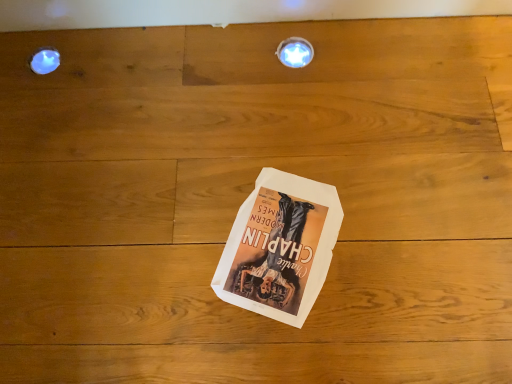
Where is `white paper at center`? white paper at center is located at coordinates (280, 247).

You are a GUI agent. You are given a task and a screenshot of the screen. Output one action in this format:
    pyautogui.click(x=<x>, y=<y>)
    Task: Click on the metallic circular light fixture at upper center
    This screenshot has height=384, width=512.
    Given the screenshot: What is the action you would take?
    pyautogui.click(x=295, y=52)

Is metallic circular light fixture at upper center directly adjacent to white paper at center?

They are not placed beside each other.

Does metallic circular light fixture at upper center have a greater height compared to white paper at center?

Yes.

Relative to white paper at center, is metallic circular light fixture at upper center in front or behind?

In the image, metallic circular light fixture at upper center appears behind white paper at center.

In terms of height, does white paper at center look taller or shorter compared to metallic circular light fixture at upper center?

white paper at center is shorter than metallic circular light fixture at upper center.

Would you say white paper at center is outside metallic circular light fixture at upper center?

That's correct, white paper at center is outside of metallic circular light fixture at upper center.

Which is farther from the camera, (311,204) or (293,45)?

Positioned behind is point (293,45).

Are metallic circular light fixture at upper center and matte white droplight at upper left beside each other?

They are not placed beside each other.

Is metallic circular light fixture at upper center taller than matte white droplight at upper left?

Yes.

Between metallic circular light fixture at upper center and matte white droplight at upper left, which one has larger width?

metallic circular light fixture at upper center.

Where is `droplight that appears above the white paper at center (from the image's perspective)`? The height and width of the screenshot is (384, 512). droplight that appears above the white paper at center (from the image's perspective) is located at coordinates (45, 60).

From a real-world perspective, does white paper at center stand above matte white droplight at upper left?

Correct, in the physical world, white paper at center is higher than matte white droplight at upper left.

Is white paper at center beside matte white droplight at upper left?

No, white paper at center is not touching matte white droplight at upper left.

From the image's perspective, is white paper at center on matte white droplight at upper left?

Incorrect, from the image's perspective, white paper at center is lower than matte white droplight at upper left.

Could you tell me if matte white droplight at upper left is facing white paper at center?

No, matte white droplight at upper left is not facing towards white paper at center.

From the image's perspective, who appears lower, matte white droplight at upper left or white paper at center?

white paper at center, from the image's perspective.

From the picture: Considering the sizes of matte white droplight at upper left and white paper at center in the image, is matte white droplight at upper left bigger or smaller than white paper at center?

Clearly, matte white droplight at upper left is smaller in size than white paper at center.

From a real-world perspective, between matte white droplight at upper left and white paper at center, who is vertically lower?

In real-world perspective, matte white droplight at upper left is lower.

From a real-world perspective, who is located higher, matte white droplight at upper left or metallic circular light fixture at upper center?

metallic circular light fixture at upper center is physically above.

Where is `droplight that is behind the metallic circular light fixture at upper center`? droplight that is behind the metallic circular light fixture at upper center is located at coordinates (45, 60).

Is matte white droplight at upper left shorter than metallic circular light fixture at upper center?

Yes.

Are matte white droplight at upper left and metallic circular light fixture at upper center beside each other?

No, matte white droplight at upper left is not with metallic circular light fixture at upper center.

Locate an element on the screen. The image size is (512, 384). light fixture behind the white paper at center is located at coordinates (295, 52).

Where is `paperback book above the metallic circular light fixture at upper center (from a real-world perspective)`? The height and width of the screenshot is (384, 512). paperback book above the metallic circular light fixture at upper center (from a real-world perspective) is located at coordinates (280, 247).

Based on their spatial positions, is matte white droplight at upper left or white paper at center closer to metallic circular light fixture at upper center?

Based on the image, white paper at center appears to be nearer to metallic circular light fixture at upper center.

Based on their spatial positions, is white paper at center or matte white droplight at upper left closer to metallic circular light fixture at upper center?

white paper at center.

Which object lies nearer to the anchor point matte white droplight at upper left, metallic circular light fixture at upper center or white paper at center?

metallic circular light fixture at upper center lies closer to matte white droplight at upper left than the other object.

Based on their spatial positions, is matte white droplight at upper left or metallic circular light fixture at upper center further from white paper at center?

matte white droplight at upper left is positioned further to the anchor white paper at center.

Which object lies nearer to the anchor point white paper at center, metallic circular light fixture at upper center or matte white droplight at upper left?

metallic circular light fixture at upper center.

When comparing their distances from matte white droplight at upper left, does white paper at center or metallic circular light fixture at upper center seem further?

The object further to matte white droplight at upper left is white paper at center.

The image size is (512, 384). What are the coordinates of `paperback book between matte white droplight at upper left and metallic circular light fixture at upper center in the horizontal direction` in the screenshot? It's located at (280, 247).